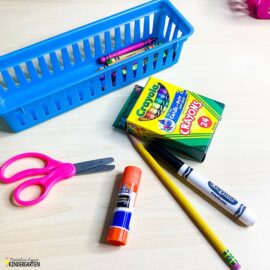
The width and height of the screenshot is (270, 270). Identify the location of marker cap. (164, 155).